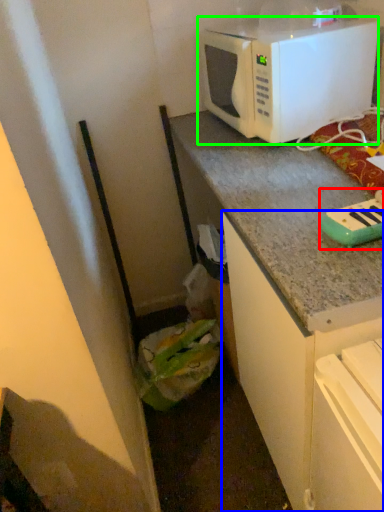
Question: Considering the real-world distances, which object is closest to appliance (highlighted by a red box)? cabinetry (highlighted by a blue box) or microwave oven (highlighted by a green box).

Choices:
 (A) cabinetry
 (B) microwave oven

Answer: (A)